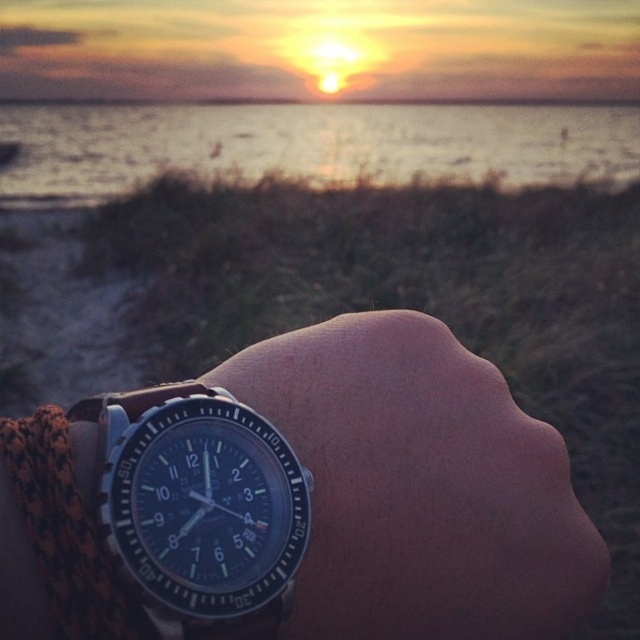
Question: Is matte water at center thinner than blue metallic watch at lower left?

Choices:
 (A) no
 (B) yes

Answer: (A)

Question: Which object appears farthest from the camera in this image?

Choices:
 (A) black leather watch at center
 (B) blue metallic watch at lower left
 (C) matte water at center

Answer: (C)

Question: Where is black leather watch at center located in relation to matte water at center in the image?

Choices:
 (A) right
 (B) left

Answer: (A)

Question: Which object is positioned closest to the black leather watch at center?

Choices:
 (A) blue metallic watch at lower left
 (B) matte water at center

Answer: (A)

Question: From the image, what is the correct spatial relationship of black leather watch at center in relation to blue metallic watch at lower left?

Choices:
 (A) above
 (B) below

Answer: (B)

Question: Estimate the real-world distances between objects in this image. Which object is farther from the blue metallic watch at lower left?

Choices:
 (A) black leather watch at center
 (B) matte water at center

Answer: (B)